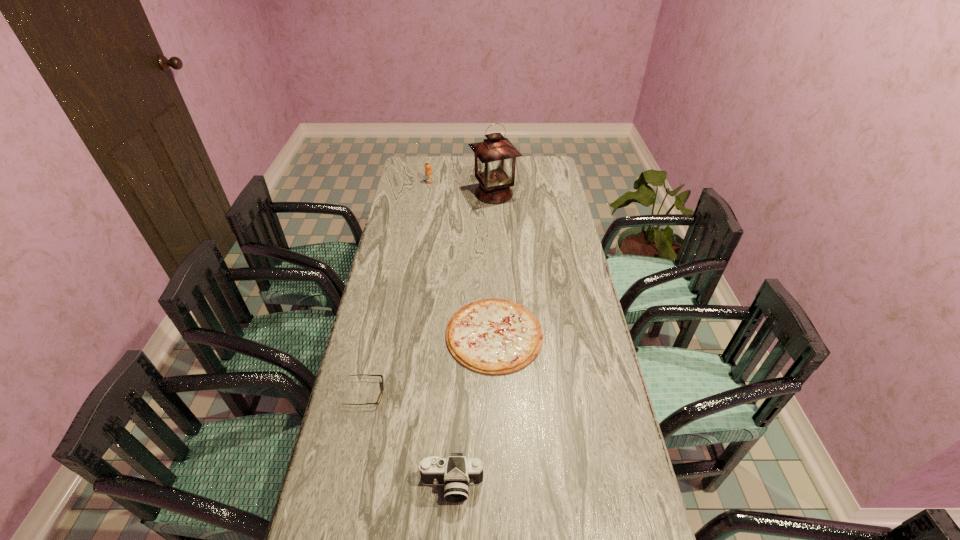
What are the coordinates of `free spot between the pizza and the second nearest object` in the screenshot? It's located at (430, 364).

What are the coordinates of `free space between the leftmost object and the second object from left to right` in the screenshot? It's located at (397, 288).

Identify the location of free space between the fourth tallest object and the pizza. (430, 364).

You are a GUI agent. You are given a task and a screenshot of the screen. Output one action in this format:
    pyautogui.click(x=<x>, y=<y>)
    Task: Click on the free space between the camera and the pizza
    This screenshot has width=960, height=540.
    Given the screenshot: What is the action you would take?
    pyautogui.click(x=473, y=410)

I want to click on free spot between the fourth object from right to left and the pizza, so click(462, 259).

Select which object is the closest to the camera. Please provide its 2D coordinates. Your answer should be formatted as a tuple, i.e. [(x, y)], where the tuple contains the x and y coordinates of a point satisfying the conditions above.

[(380, 397)]

Choose which object is the fourth nearest neighbor to the third farthest object. Please provide its 2D coordinates. Your answer should be formatted as a tuple, i.e. [(x, y)], where the tuple contains the x and y coordinates of a point satisfying the conditions above.

[(428, 172)]

Locate an element on the screen. This screenshot has width=960, height=540. free space that satisfies the following two spatial constraints: 1. on the front label of the second object from left to right; 2. on the right side of the tallest object is located at coordinates (427, 194).

The width and height of the screenshot is (960, 540). I want to click on vacant position in the image that satisfies the following two spatial constraints: 1. on the front label of the orange juice; 2. on the front-facing side of the sunglasses, so click(396, 393).

Where is `vacant space that satisfies the following two spatial constraints: 1. on the front label of the third nearest object; 2. on the left side of the second object from left to right`? vacant space that satisfies the following two spatial constraints: 1. on the front label of the third nearest object; 2. on the left side of the second object from left to right is located at coordinates 405,335.